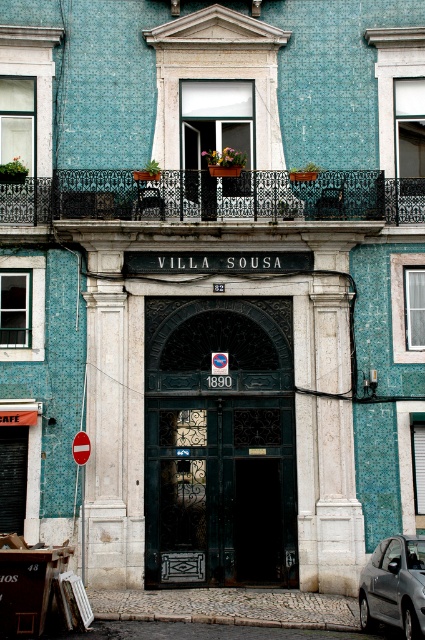
Does dark green wrought iron door at center come behind black wrought iron balcony at upper center?

No, dark green wrought iron door at center is closer to the viewer.

Does dark green wrought iron door at center appear over black wrought iron balcony at upper center?

Incorrect, dark green wrought iron door at center is not positioned above black wrought iron balcony at upper center.

Is point (274, 476) in front of point (150, 182)?

Yes.

In order to click on dark green wrought iron door at center in this screenshot , I will do `click(220, 490)`.

Does black wrought iron balcony at upper center have a greater width compared to metallic gray car at lower right?

Indeed, black wrought iron balcony at upper center has a greater width compared to metallic gray car at lower right.

Is point (294, 208) closer to camera compared to point (394, 602)?

No.

Locate an element on the screen. The image size is (425, 640). black wrought iron balcony at upper center is located at coordinates (212, 196).

From the picture: Who is taller, dark green wrought iron door at center or metallic gray car at lower right?

dark green wrought iron door at center

Between dark green wrought iron door at center and metallic gray car at lower right, which one appears on the right side from the viewer's perspective?

metallic gray car at lower right is more to the right.

Describe the element at coordinates (220, 490) in the screenshot. I see `dark green wrought iron door at center` at that location.

This screenshot has width=425, height=640. I want to click on dark green wrought iron door at center, so click(x=220, y=490).